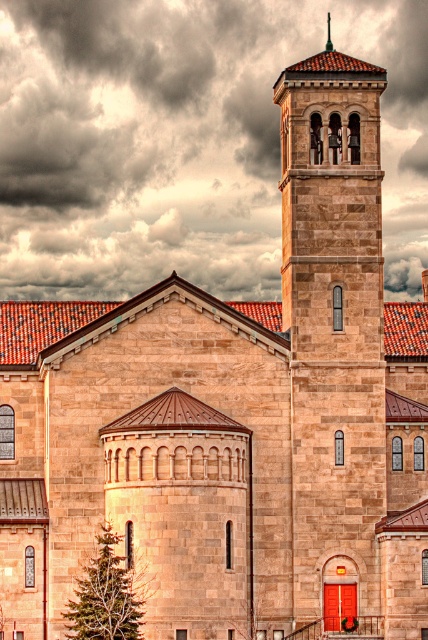
Question: Which point appears closest to the camera in this image?

Choices:
 (A) [386, 134]
 (B) [329, 272]
 (C) [327, 13]

Answer: (B)

Question: Which object is closer to the camera taking this photo?

Choices:
 (A) stone bell tower at center
 (B) dark gray cloud at upper center

Answer: (A)

Question: Is the position of dark gray cloud at upper center more distant than that of gold textured cross at upper center?

Choices:
 (A) yes
 (B) no

Answer: (A)

Question: Which point is farther to the camera?

Choices:
 (A) (327, 32)
 (B) (366, 141)
 (C) (181, 243)

Answer: (A)

Question: Can you confirm if dark gray cloud at upper center is positioned to the right of gold textured cross at upper center?

Choices:
 (A) no
 (B) yes

Answer: (A)

Question: In this image, where is stone bell tower at center located relative to gold textured cross at upper center?

Choices:
 (A) below
 (B) above

Answer: (A)